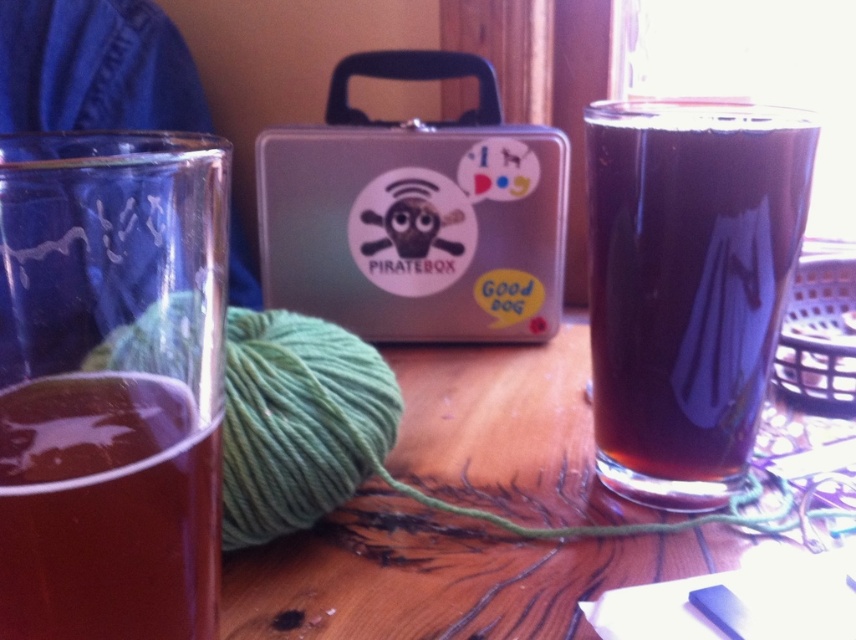
Is dark brown liquid at right bigger than brown translucent liquid at left?

Yes.

The image size is (856, 640). What are the coordinates of `dark brown liquid at right` in the screenshot? It's located at (688, 285).